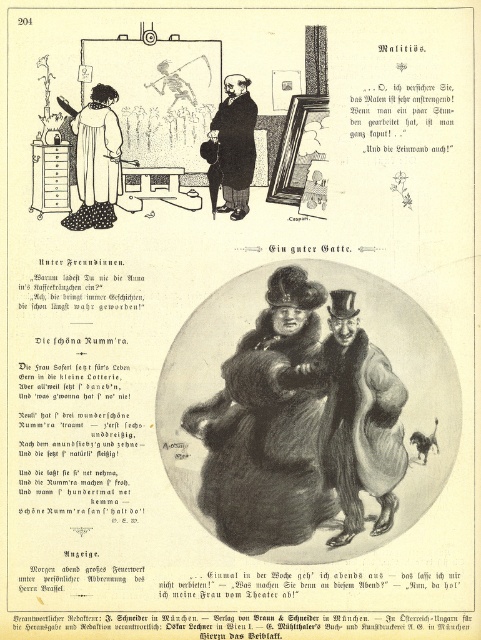
Question: Can you confirm if fluffy white robe at upper left is wider than smooth black coat at center?

Choices:
 (A) no
 (B) yes

Answer: (B)

Question: Does smooth fur coat at center have a larger size compared to smooth black coat at center?

Choices:
 (A) no
 (B) yes

Answer: (B)

Question: Which point appears closest to the camera in this image?

Choices:
 (A) (205, 496)
 (B) (237, 172)

Answer: (A)

Question: Which of these objects is positioned farthest from the smooth black coat at center?

Choices:
 (A) smooth fur coat at center
 (B) fluffy white robe at upper left

Answer: (A)

Question: Is smooth fur coat at center wider than smooth black coat at center?

Choices:
 (A) no
 (B) yes

Answer: (B)

Question: Which point is closer to the camera taking this photo?

Choices:
 (A) (92, 189)
 (B) (223, 104)
 (C) (394, 388)

Answer: (C)